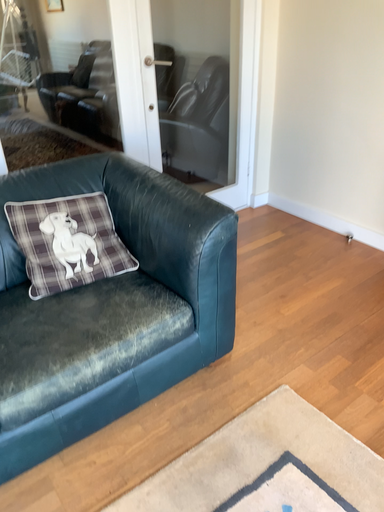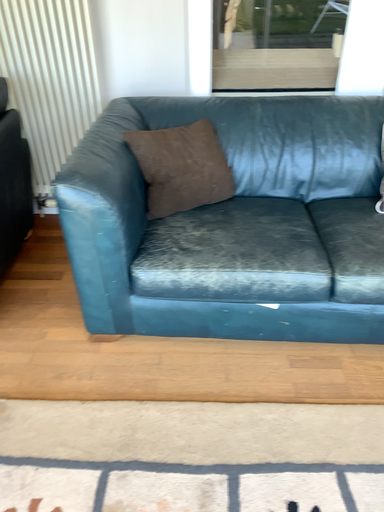
Question: Which way did the camera rotate in the video?

Choices:
 (A) rotated left
 (B) rotated right

Answer: (A)